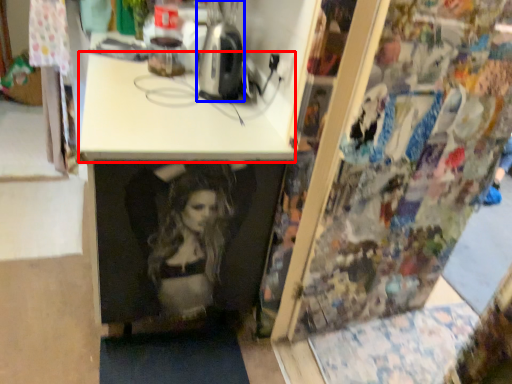
Question: Which point is closer to the camera, counter top (highlighted by a red box) or appliance (highlighted by a blue box)?

Choices:
 (A) counter top
 (B) appliance

Answer: (A)